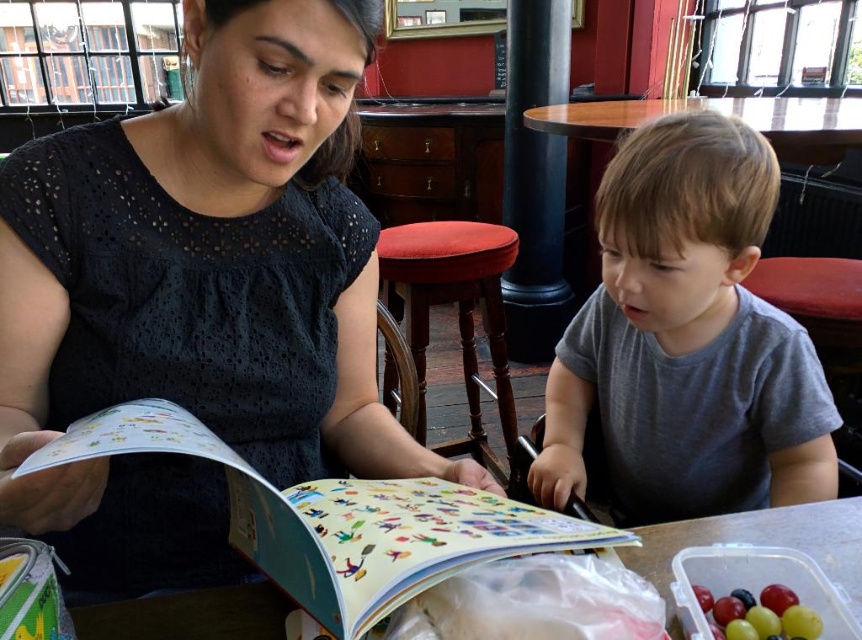
Can you confirm if matte black dress at center is positioned above red leather stool at right?

Correct, matte black dress at center is located above red leather stool at right.

Between point (355, 61) and point (846, 422), which one is positioned behind?

Positioned behind is point (846, 422).

Image resolution: width=862 pixels, height=640 pixels. What do you see at coordinates (198, 296) in the screenshot? I see `matte black dress at center` at bounding box center [198, 296].

Where is `matte black dress at center`? matte black dress at center is located at coordinates (198, 296).

Can you confirm if matte paper book at center is smaller than white plastic table at center?

No, matte paper book at center is not smaller than white plastic table at center.

Is matte paper book at center bigger than white plastic table at center?

Yes, matte paper book at center is bigger than white plastic table at center.

At what (x,y) coordinates should I click in order to perform the action: click on matte paper book at center. Please return your answer as a coordinate pair (x, y). This screenshot has height=640, width=862. Looking at the image, I should click on (336, 518).

The image size is (862, 640). What are the coordinates of `matte paper book at center` in the screenshot? It's located at (336, 518).

Which is above, red fabric stool at center or red leather stool at right?

Positioned higher is red leather stool at right.

Who is more forward, (434, 296) or (779, 272)?

Point (779, 272) is in front.

Image resolution: width=862 pixels, height=640 pixels. What do you see at coordinates (457, 314) in the screenshot? I see `red fabric stool at center` at bounding box center [457, 314].

Locate an element on the screen. The height and width of the screenshot is (640, 862). red fabric stool at center is located at coordinates (457, 314).